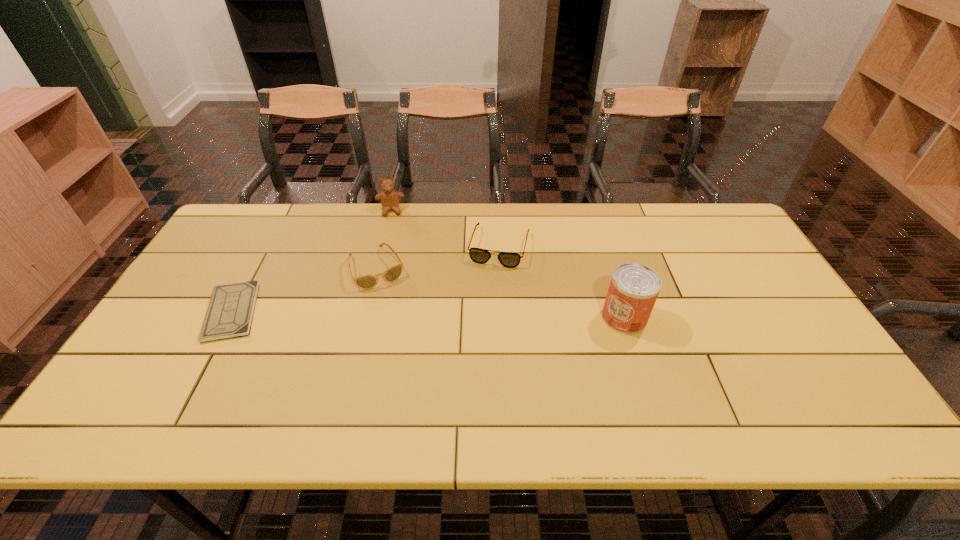
Where is `free region located on the front-facing side of the sunglasses`? The width and height of the screenshot is (960, 540). free region located on the front-facing side of the sunglasses is located at coordinates (416, 353).

Identify the location of vacant space located on the front-facing side of the sunglasses. (415, 349).

Locate an element on the screen. The image size is (960, 540). vacant space located on the front-facing side of the sunglasses is located at coordinates (398, 317).

Find the location of a particular element. The height and width of the screenshot is (540, 960). vacant space located 0.360m on the front-facing side of the spectacles is located at coordinates (x=467, y=367).

Where is `free spot located 0.340m on the front-facing side of the spectacles`? free spot located 0.340m on the front-facing side of the spectacles is located at coordinates (468, 360).

Find the location of a particular element. The image size is (960, 540). vacant region located 0.380m on the front-facing side of the spectacles is located at coordinates (465, 374).

Locate an element on the screen. vacant point located 0.380m on the face of the teddy bear is located at coordinates (397, 298).

This screenshot has width=960, height=540. I want to click on free space located on the face of the teddy bear, so click(394, 254).

Locate an element on the screen. vacant space situated 0.300m on the face of the teddy bear is located at coordinates (396, 278).

Where is `sunglasses located at the far edge`? sunglasses located at the far edge is located at coordinates pos(393,273).